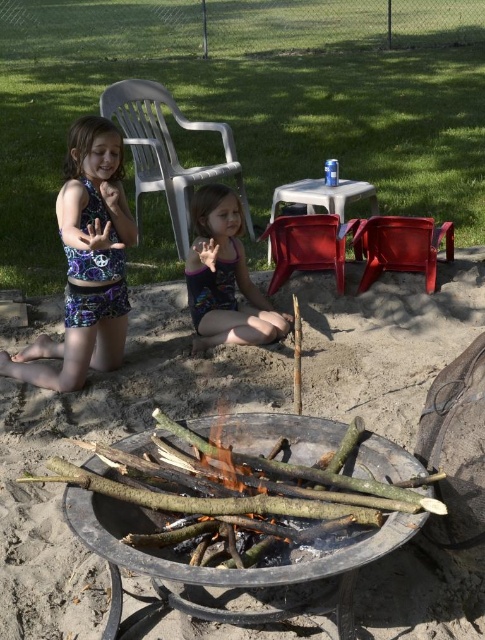
Is brown sandy ground at center positioned before printed fabric swimsuit at left?

That is True.

Does point (226, 356) come farther from viewer compared to point (110, 182)?

That is True.

Locate an element on the screen. brown sandy ground at center is located at coordinates (108, 442).

Can you confirm if purple swimsuit at center is positioned to the right of plastic chair at upper left?

Yes, purple swimsuit at center is to the right of plastic chair at upper left.

Measure the distance between purple swimsuit at center and plastic chair at upper left.

purple swimsuit at center and plastic chair at upper left are 1.51 meters apart.

This screenshot has height=640, width=485. I want to click on purple swimsuit at center, so click(225, 276).

At what (x,y) coordinates should I click in order to perform the action: click on purple swimsuit at center. Please return your answer as a coordinate pair (x, y). This screenshot has width=485, height=640. Looking at the image, I should click on (225, 276).

Does matte plastic chair at center come behind red plastic chair at center?

Yes.

Which of these two, matte plastic chair at center or red plastic chair at center, stands shorter?

Standing shorter between the two is matte plastic chair at center.

Is point (360, 291) closer to camera compared to point (287, 257)?

That is True.

At what (x,y) coordinates should I click in order to perform the action: click on matte plastic chair at center. Please return your answer as a coordinate pair (x, y). Image resolution: width=485 pixels, height=640 pixels. Looking at the image, I should click on (402, 246).